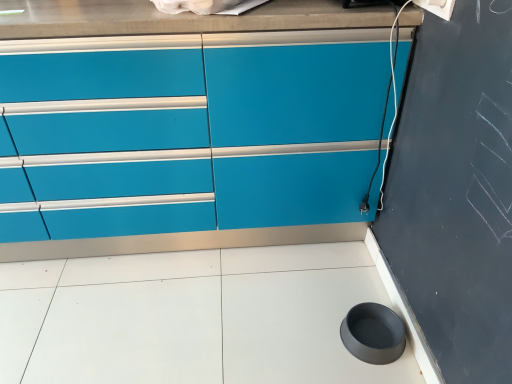
Describe the element at coordinates (203, 150) in the screenshot. I see `matte blue cabinet at center` at that location.

Measure the distance between matte blue cabinet at center and camera.

matte blue cabinet at center is 3.74 feet from camera.

The height and width of the screenshot is (384, 512). Identify the location of matte blue cabinet at center. tap(203, 150).

I want to click on matte blue cabinet at center, so click(x=203, y=150).